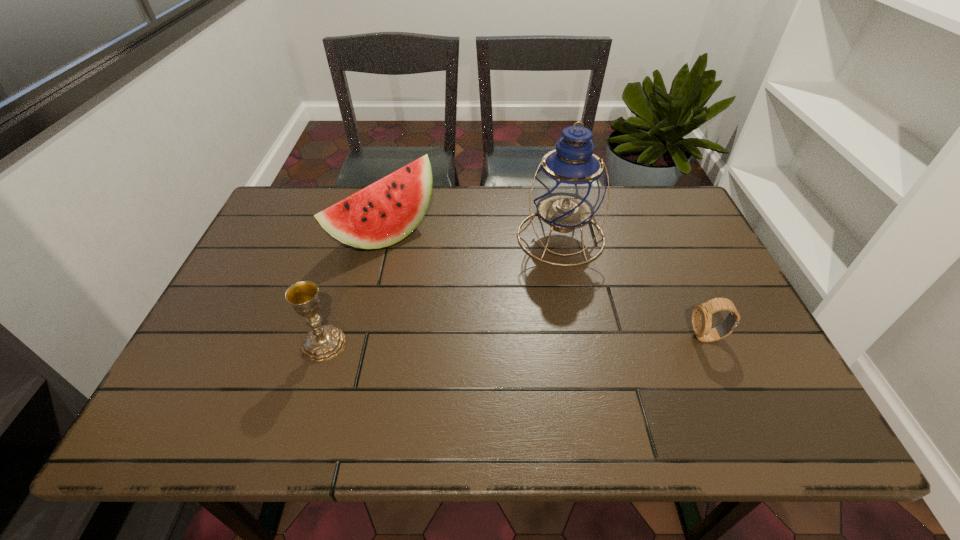
The image size is (960, 540). In the image, there is a desktop. Identify the location of blank space at the far edge. (625, 226).

Find the location of a particular element. vacant space at the near edge of the desktop is located at coordinates (496, 395).

Locate an element on the screen. The height and width of the screenshot is (540, 960). vacant area at the left edge of the desktop is located at coordinates tap(260, 237).

The height and width of the screenshot is (540, 960). In the image, there is a desktop. Identify the location of vacant space at the right edge. click(683, 274).

Identify the location of vacant area at the near left corner of the desktop. The height and width of the screenshot is (540, 960). (248, 382).

Find the location of a particular element. The height and width of the screenshot is (540, 960). vacant space in between the watermelon and the tallest object is located at coordinates (473, 235).

At what (x,y) coordinates should I click in order to perform the action: click on vacant area between the chalice and the lantern. Please return your answer as a coordinate pair (x, y). Looking at the image, I should click on (443, 290).

The height and width of the screenshot is (540, 960). Find the location of `free space between the shortest object and the chalice`. free space between the shortest object and the chalice is located at coordinates (516, 340).

I want to click on vacant area between the tallest object and the chalice, so click(x=443, y=290).

Locate an element on the screen. The height and width of the screenshot is (540, 960). unoccupied area between the shortest object and the watermelon is located at coordinates (546, 286).